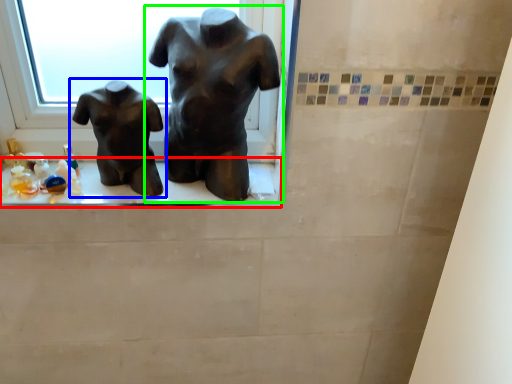
Question: Which is farther away from window sill (highlighted by a red box)? statue (sculpture) (highlighted by a blue box) or statue (sculpture) (highlighted by a green box)?

Choices:
 (A) statue (sculpture)
 (B) statue (sculpture)

Answer: (B)